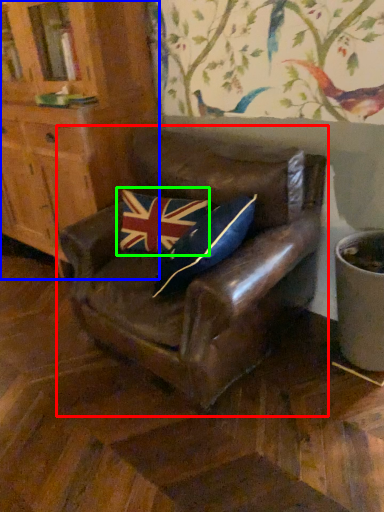
Question: Based on their relative distances, which object is nearer to chair (highlighted by a red box)? Choose from cabinetry (highlighted by a blue box) and flag (highlighted by a green box).

Choices:
 (A) cabinetry
 (B) flag

Answer: (B)